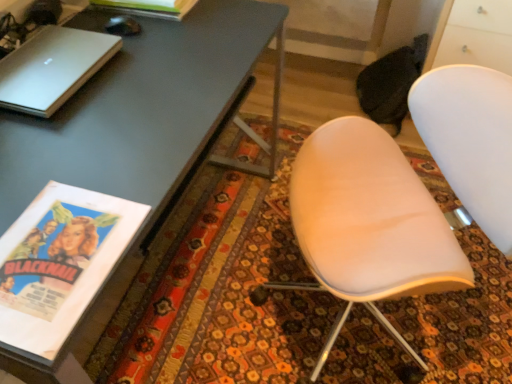
Identify the location of black glossy mouse at upper left. The image size is (512, 384). (123, 26).

Describe the element at coordinates (142, 124) in the screenshot. I see `matte gray desk at upper left` at that location.

What is the approximate width of white matte chair at center?

25.49 inches.

Measure the distance between point (x=24, y=79) and camera.

3.31 feet.

Where is `silver metallic laptop at upper left`? This screenshot has width=512, height=384. silver metallic laptop at upper left is located at coordinates (52, 68).

Where is `matte paper magazine at upper left`? Image resolution: width=512 pixels, height=384 pixels. matte paper magazine at upper left is located at coordinates (148, 7).

Locate an element on the screen. This screenshot has height=384, width=512. black glossy mouse at upper left is located at coordinates (123, 26).

Can you tell me how much white matte chair at center and black glossy mouse at upper left differ in facing direction?

There is a 170-degree angle between the facing directions of white matte chair at center and black glossy mouse at upper left.

How distant is white matte chair at center from black glossy mouse at upper left?

They are 32.18 inches apart.

Is white matte chair at center facing away from black glossy mouse at upper left?

No, black glossy mouse at upper left is not at the back of white matte chair at center.

Is white matte chair at center not near black glossy mouse at upper left?

No.

Considering their positions, is matte paper magazine at upper left located in front of or behind white matte chair at center?

matte paper magazine at upper left is positioned farther from the viewer than white matte chair at center.

Where is `magazine on the left of white matte chair at center`? This screenshot has height=384, width=512. magazine on the left of white matte chair at center is located at coordinates (148, 7).

Is matte paper magazine at upper left inside the boundaries of white matte chair at center, or outside?

matte paper magazine at upper left is outside white matte chair at center.

Considering the relative positions of black glossy mouse at upper left and matte gray desk at upper left in the image provided, is black glossy mouse at upper left to the left of matte gray desk at upper left from the viewer's perspective?

Correct, you'll find black glossy mouse at upper left to the left of matte gray desk at upper left.

Which is closer, (106, 22) or (270, 4)?

The point (106, 22) is closer.

This screenshot has height=384, width=512. Find the location of `mouse on the left side of matte gray desk at upper left`. mouse on the left side of matte gray desk at upper left is located at coordinates (123, 26).

Is silver metallic laptop at upper left oriented towards black glossy mouse at upper left?

No, silver metallic laptop at upper left is not turned towards black glossy mouse at upper left.

Considering the positions of objects silver metallic laptop at upper left and black glossy mouse at upper left in the image provided, who is behind, silver metallic laptop at upper left or black glossy mouse at upper left?

black glossy mouse at upper left is further away from the camera.

Between silver metallic laptop at upper left and black glossy mouse at upper left, which one has larger width?

With larger width is silver metallic laptop at upper left.

Is black glossy mouse at upper left inside silver metallic laptop at upper left?

No, black glossy mouse at upper left is not inside silver metallic laptop at upper left.

Does point (431, 214) come in front of point (247, 21)?

Yes, point (431, 214) is closer to viewer.

Is white matte chair at center turned away from matte gray desk at upper left?

No.

From a real-world perspective, which is physically above, white matte chair at center or matte gray desk at upper left?

From a 3D spatial view, white matte chair at center is above.

Is white matte chair at center not within matte gray desk at upper left?

white matte chair at center lies outside matte gray desk at upper left's area.

Is matte paper magazine at upper left bigger or smaller than silver metallic laptop at upper left?

Clearly, matte paper magazine at upper left is larger in size than silver metallic laptop at upper left.

Which object is further away from the camera, matte paper magazine at upper left or silver metallic laptop at upper left?

Positioned behind is matte paper magazine at upper left.

Is matte paper magazine at upper left thinner than silver metallic laptop at upper left?

No.

Does matte paper magazine at upper left have a greater height compared to silver metallic laptop at upper left?

Yes, matte paper magazine at upper left is taller than silver metallic laptop at upper left.

Consider the image. Which object is wider, black glossy mouse at upper left or white matte chair at center?

white matte chair at center is wider.

From the image's perspective, is black glossy mouse at upper left under white matte chair at center?

Actually, black glossy mouse at upper left appears above white matte chair at center in the image.

Is point (120, 16) closer or farther from the camera than point (377, 249)?

Point (120, 16) is farther from the camera than point (377, 249).

In the scene shown: In terms of size, does black glossy mouse at upper left appear bigger or smaller than white matte chair at center?

black glossy mouse at upper left is smaller than white matte chair at center.

This screenshot has height=384, width=512. What are the coordinates of `chair that is under the black glossy mouse at upper left (from a real-world perspective)` in the screenshot? It's located at (367, 226).

You are a GUI agent. You are given a task and a screenshot of the screen. Output one action in this format:
    pyautogui.click(x=<x>, y=<y>)
    Task: Click on the magazine above the white matte chair at center (from the image's perspective)
    
    Given the screenshot: What is the action you would take?
    pyautogui.click(x=148, y=7)

Which object lies nearer to the anchor point white matte chair at center, silver metallic laptop at upper left or matte gray desk at upper left?

matte gray desk at upper left is positioned closer to the anchor white matte chair at center.

Based on the photo, considering their positions, is matte gray desk at upper left positioned closer to matte paper magazine at upper left than white matte chair at center?

Based on the image, matte gray desk at upper left appears to be nearer to matte paper magazine at upper left.

Consider the image. Which object lies nearer to the anchor point silver metallic laptop at upper left, white matte chair at center or matte gray desk at upper left?

matte gray desk at upper left is closer to silver metallic laptop at upper left.

From the image, which object appears to be farther from matte paper magazine at upper left, matte gray desk at upper left or silver metallic laptop at upper left?

silver metallic laptop at upper left.

Estimate the real-world distances between objects in this image. Which object is closer to silver metallic laptop at upper left, black glossy mouse at upper left or matte gray desk at upper left?

matte gray desk at upper left is positioned closer to the anchor silver metallic laptop at upper left.

From the image, which object appears to be nearer to black glossy mouse at upper left, matte paper magazine at upper left or white matte chair at center?

Among the two, matte paper magazine at upper left is located nearer to black glossy mouse at upper left.

Based on the photo, which object lies further to the anchor point black glossy mouse at upper left, silver metallic laptop at upper left or white matte chair at center?

The object further to black glossy mouse at upper left is white matte chair at center.

Looking at the image, which one is located further to matte gray desk at upper left, silver metallic laptop at upper left or matte paper magazine at upper left?

matte paper magazine at upper left.

You are a GUI agent. You are given a task and a screenshot of the screen. Output one action in this format:
    pyautogui.click(x=<x>, y=<y>)
    Task: Click on the desk situated between silver metallic laptop at upper left and white matte chair at center from left to right
    Image resolution: width=512 pixels, height=384 pixels.
    Given the screenshot: What is the action you would take?
    pyautogui.click(x=142, y=124)

At what (x,y) coordinates should I click in order to perform the action: click on desk between black glossy mouse at upper left and white matte chair at center in the horizontal direction. Please return your answer as a coordinate pair (x, y). This screenshot has height=384, width=512. Looking at the image, I should click on (142, 124).

Where is `mouse between matte paper magazine at upper left and white matte chair at center in the up-down direction`? mouse between matte paper magazine at upper left and white matte chair at center in the up-down direction is located at coordinates (123, 26).

What are the coordinates of `desk between matte paper magazine at upper left and white matte chair at center from top to bottom` in the screenshot? It's located at (142, 124).